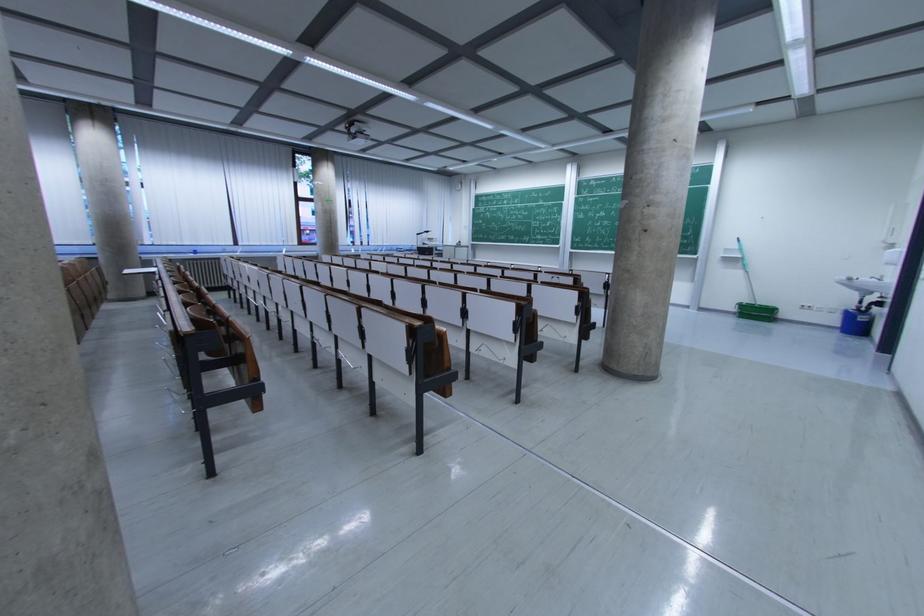
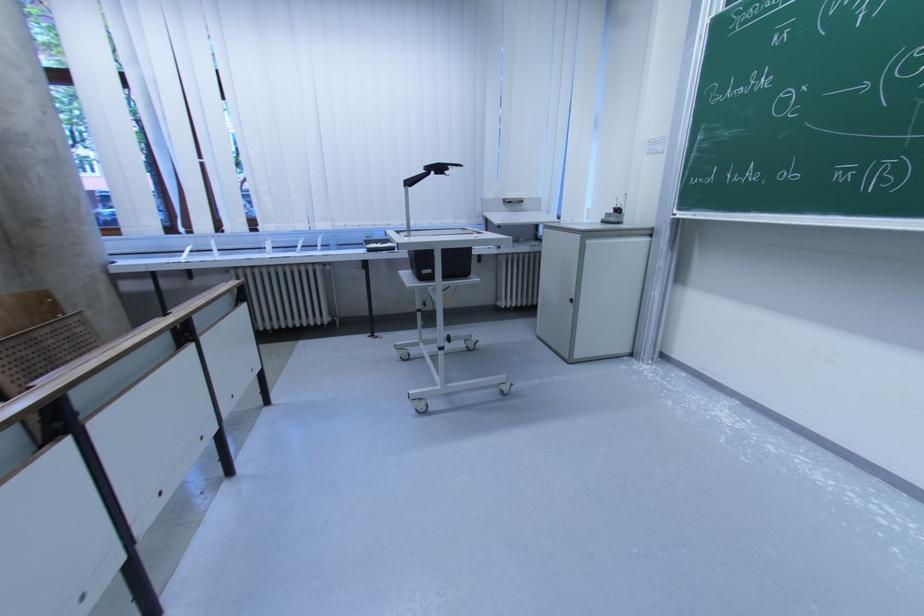
Find the pixel in the second image that matches (465,245) in the first image.

(622, 213)